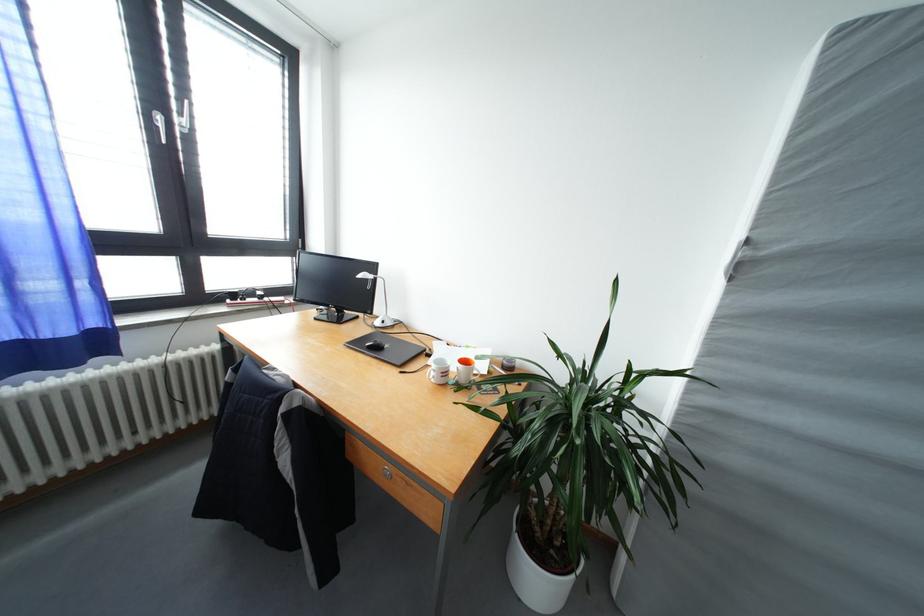
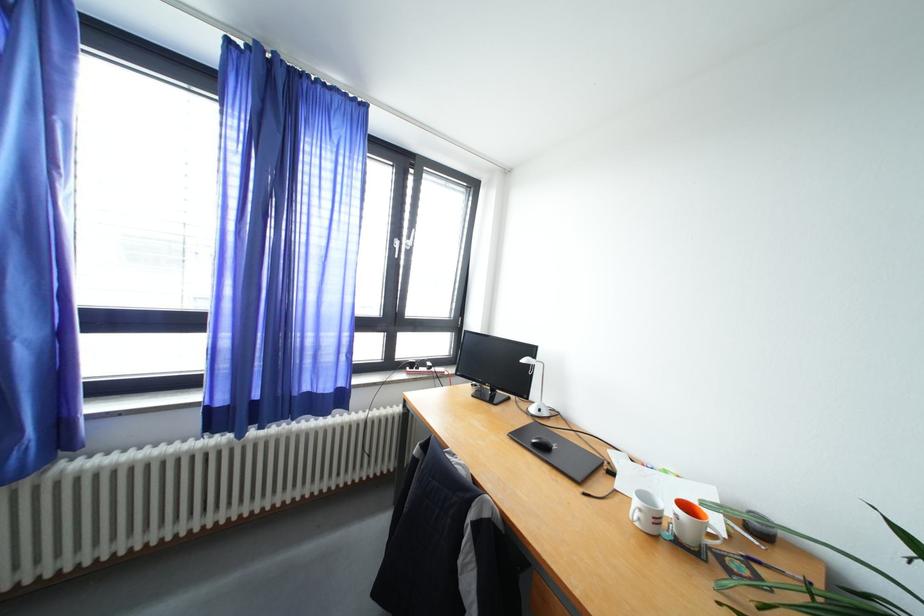
Question: Based on the continuous images, in which direction is the camera rotating? Reply with the corresponding letter.

Choices:
 (A) Left
 (B) Right
 (C) Up
 (D) Down

Answer: (A)